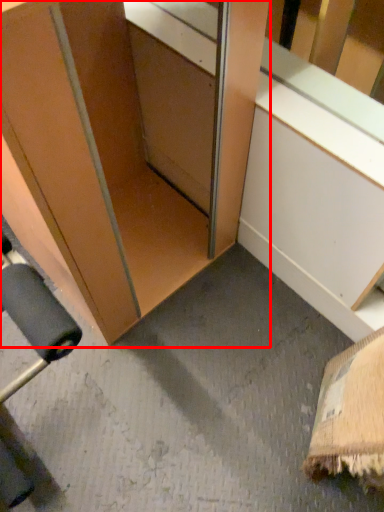
Question: From the image's perspective, considering the relative positions of cabinetry (annotated by the red box) and window sill in the image provided, where is cabinetry (annotated by the red box) located with respect to the staircase?

Choices:
 (A) above
 (B) below

Answer: (A)